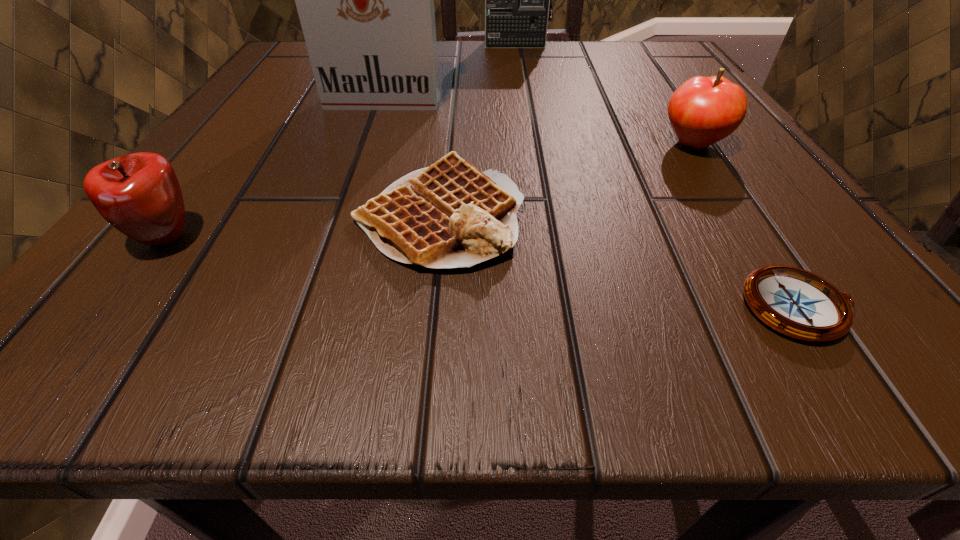
Where is `free space located 0.050m on the back of the right apple`? This screenshot has height=540, width=960. free space located 0.050m on the back of the right apple is located at coordinates (671, 111).

At what (x,y) coordinates should I click in order to perform the action: click on blank area located 0.050m on the back of the nearer apple. Please return your answer as a coordinate pair (x, y). This screenshot has height=540, width=960. Looking at the image, I should click on (202, 190).

Find the location of a particular element. This screenshot has width=960, height=540. vacant region located on the back of the second shortest object is located at coordinates (447, 139).

Locate an element on the screen. vacant space situated on the back of the compass is located at coordinates (683, 129).

I want to click on radio receiver located in the far edge section of the desktop, so click(x=518, y=0).

Identify the location of cigarette case that is at the far edge. (365, 0).

Where is `object that is positioned at the near edge`? object that is positioned at the near edge is located at coordinates click(795, 302).

You are a GUI agent. You are given a task and a screenshot of the screen. Output one action in this format:
    pyautogui.click(x=<x>, y=<y>)
    Task: Click on the cigarette case positioned at the left edge
    
    Given the screenshot: What is the action you would take?
    pyautogui.click(x=365, y=0)

Where is `apple that is at the left edge`? Image resolution: width=960 pixels, height=540 pixels. apple that is at the left edge is located at coordinates (139, 194).

Locate an element on the screen. Image resolution: width=960 pixels, height=540 pixels. apple that is at the right edge is located at coordinates (704, 110).